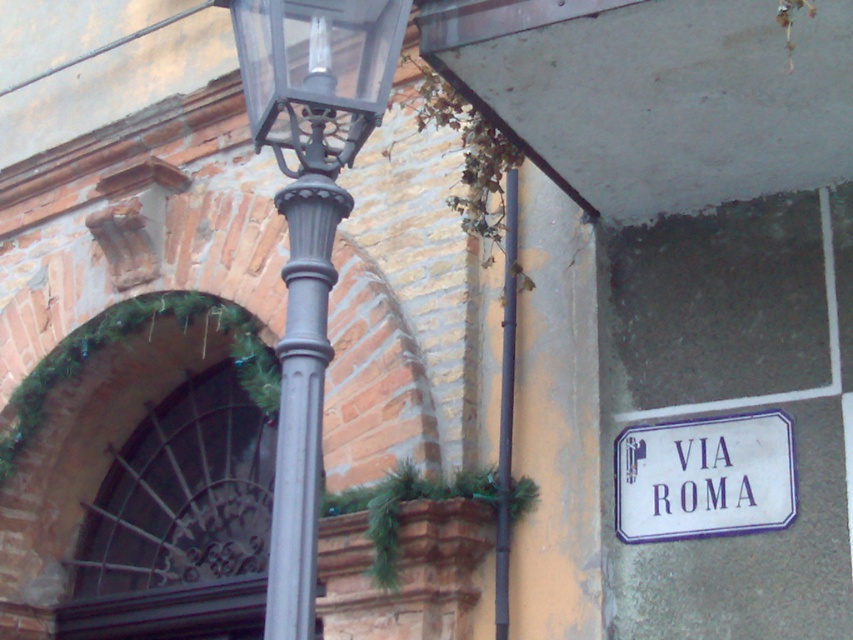
Can you confirm if matte black lantern at upper center is thinner than metallic gray pole at center?

No, matte black lantern at upper center is not thinner than metallic gray pole at center.

The height and width of the screenshot is (640, 853). I want to click on matte black lantern at upper center, so click(316, 74).

I want to click on white plastic street sign at lower right, so click(x=703, y=477).

Between point (676, 442) and point (515, 298), which one is positioned in front?

Positioned in front is point (676, 442).

The height and width of the screenshot is (640, 853). I want to click on white plastic street sign at lower right, so click(703, 477).

Which is in front, point (352, 96) or point (785, 472)?

Point (352, 96)

Is matte black street light at center to the right of white plastic street sign at lower right from the viewer's perspective?

Incorrect, matte black street light at center is not on the right side of white plastic street sign at lower right.

Which is behind, point (299, 253) or point (770, 477)?

Point (770, 477)

Where is `matte black street light at center`? matte black street light at center is located at coordinates (309, 230).